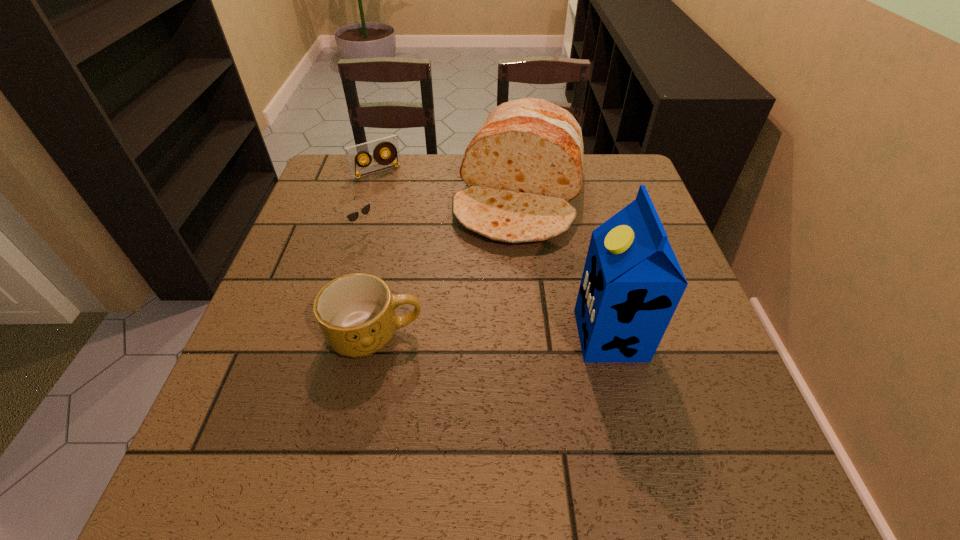
What are the coordinates of `mug` in the screenshot? It's located at (356, 312).

Locate an element on the screen. This screenshot has height=540, width=960. the tallest object is located at coordinates (632, 283).

The image size is (960, 540). In order to click on videotape in this screenshot , I will do `click(354, 154)`.

The height and width of the screenshot is (540, 960). I want to click on the shortest object, so click(353, 216).

Where is `bread`? This screenshot has height=540, width=960. bread is located at coordinates (525, 163).

At what (x,y) coordinates should I click in order to perform the action: click on vacant space situated 0.210m on the side with the handle of the mug. Please return your answer as a coordinate pair (x, y). This screenshot has width=960, height=540. Looking at the image, I should click on (528, 335).

The width and height of the screenshot is (960, 540). In order to click on vacant area situated with the cap open on the tallest object in this screenshot , I will do `click(497, 335)`.

Locate an element on the screen. vacant position located 0.160m with the cap open on the tallest object is located at coordinates (497, 335).

This screenshot has height=540, width=960. I want to click on free space located with the cap open on the tallest object, so click(x=468, y=335).

You are a GUI agent. You are given a task and a screenshot of the screen. Output one action in this format:
    pyautogui.click(x=<x>, y=<y>)
    Task: Click on the vacant space located 0.130m at the front of the videotape with visible reels
    The width and height of the screenshot is (960, 540).
    Given the screenshot: What is the action you would take?
    pyautogui.click(x=405, y=203)